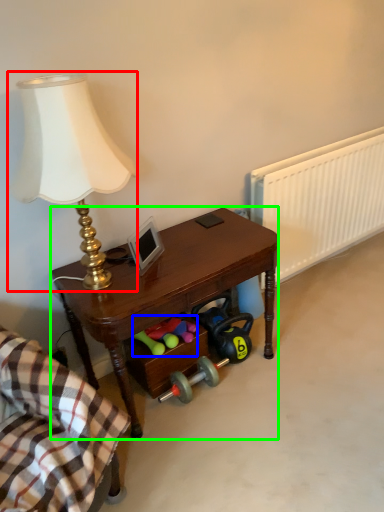
Question: Which object is positioned farthest from lamp (highlighted by a red box)? Select from stuff (highlighted by a blue box) and desk (highlighted by a green box).

Choices:
 (A) stuff
 (B) desk

Answer: (A)